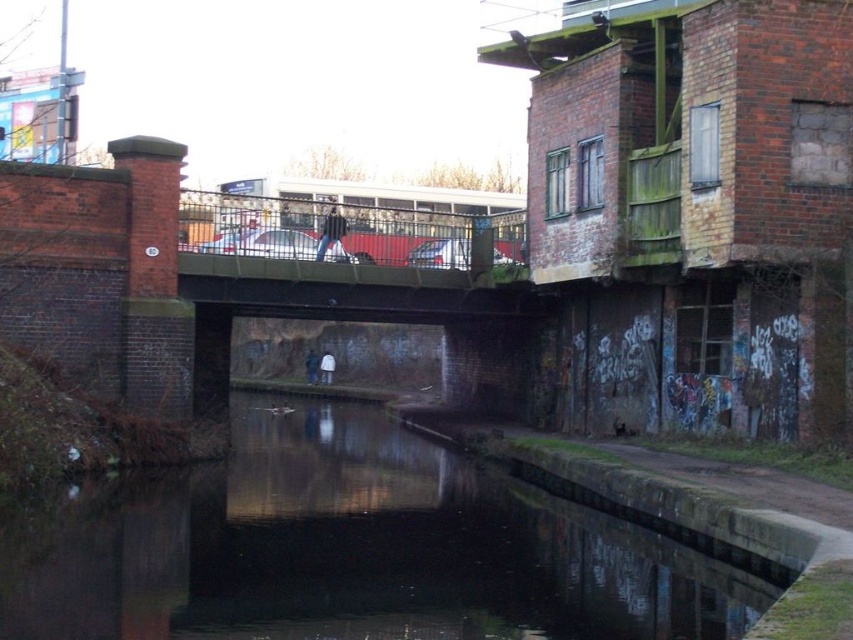
Question: Does striped fabric person at center appear on the left side of dark blue jeans at center?

Choices:
 (A) no
 (B) yes

Answer: (A)

Question: Can you confirm if dark concrete water at center is positioned to the right of striped fabric person at center?

Choices:
 (A) yes
 (B) no

Answer: (A)

Question: Which point is closer to the camera?

Choices:
 (A) striped fabric person at center
 (B) dark concrete water at center
 (C) white matte jacket at center

Answer: (B)

Question: Is dark concrete water at center smaller than white matte jacket at center?

Choices:
 (A) yes
 (B) no

Answer: (B)

Question: Considering the real-world distances, which object is farthest from the striped fabric person at center?

Choices:
 (A) dark blue jeans at center
 (B) dark concrete water at center

Answer: (A)

Question: Which is nearer to the white matte jacket at center?

Choices:
 (A) striped fabric person at center
 (B) dark concrete water at center
 (C) dark blue jeans at center

Answer: (C)